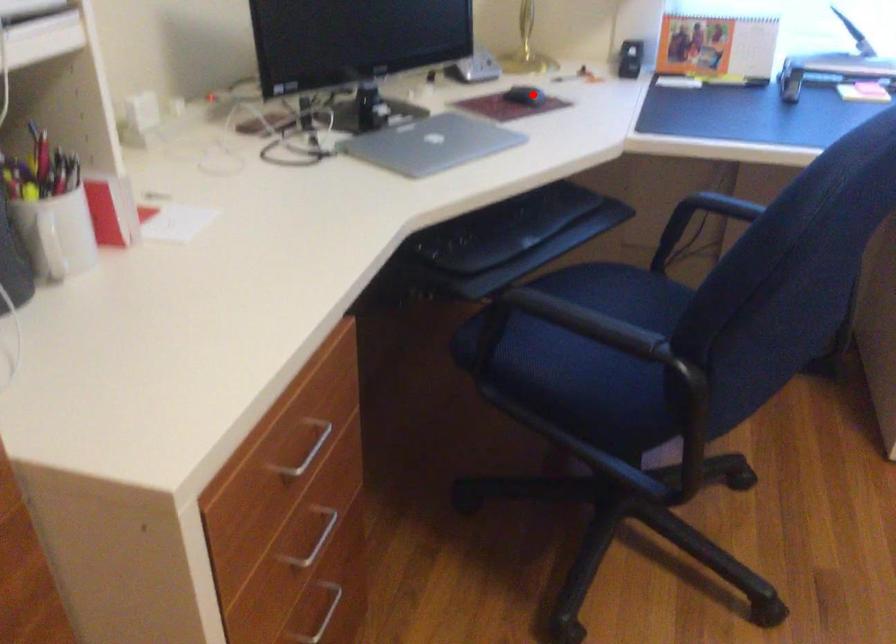
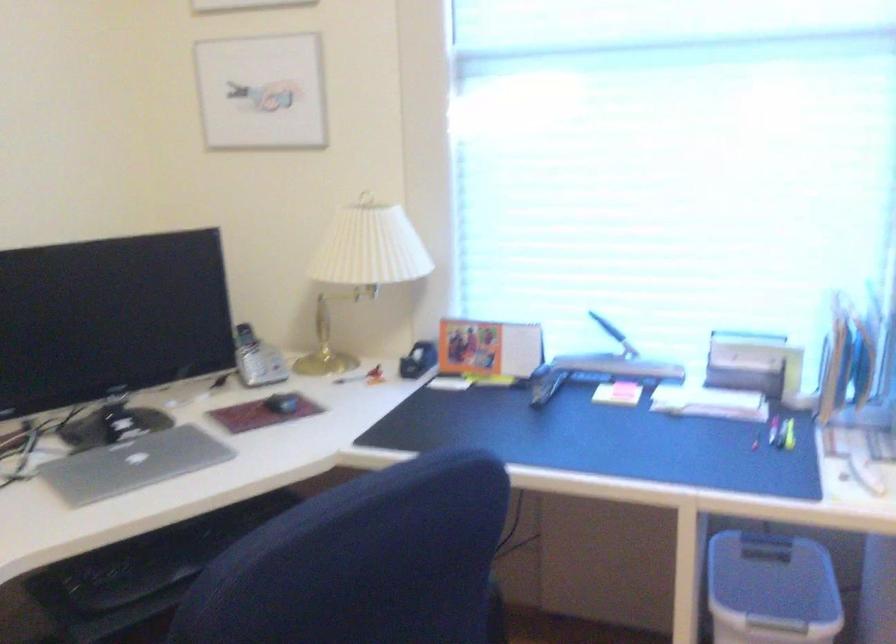
Find the pixel in the second image that matches the highlighted location in the first image.

(281, 402)